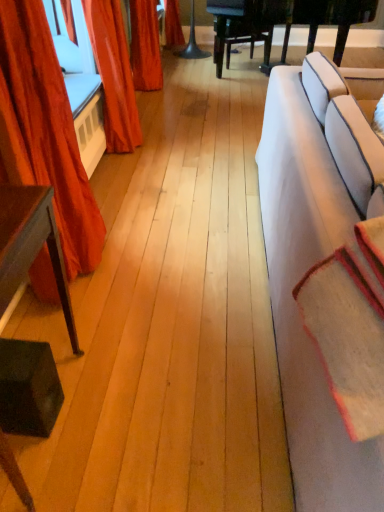
Question: Can you see velvet orange curtain at upper left, positioned as the second curtain in front-to-back order, touching velvet red curtain at left, acting as the 2th curtain starting from the back?

Choices:
 (A) yes
 (B) no

Answer: (B)

Question: Is velvet orange curtain at upper left, which appears as the first curtain when viewed from the back, at the right side of velvet red curtain at left, the 1th curtain viewed from the front?

Choices:
 (A) yes
 (B) no

Answer: (A)

Question: Is velvet orange curtain at upper left, which appears as the first curtain when viewed from the back, smaller than velvet red curtain at left, the 1th curtain viewed from the front?

Choices:
 (A) no
 (B) yes

Answer: (B)

Question: Is velvet orange curtain at upper left, which appears as the first curtain when viewed from the back, bigger than velvet red curtain at left, the 1th curtain viewed from the front?

Choices:
 (A) no
 (B) yes

Answer: (A)

Question: Considering the relative sizes of velvet orange curtain at upper left, which appears as the first curtain when viewed from the back, and velvet red curtain at left, acting as the 2th curtain starting from the back, in the image provided, is velvet orange curtain at upper left, which appears as the first curtain when viewed from the back, shorter than velvet red curtain at left, acting as the 2th curtain starting from the back,?

Choices:
 (A) no
 (B) yes

Answer: (B)

Question: From a real-world perspective, is dark brown wood table at left physically located above or below white fabric couch at right?

Choices:
 (A) above
 (B) below

Answer: (B)

Question: From the image's perspective, is dark brown wood table at left located above or below white fabric couch at right?

Choices:
 (A) below
 (B) above

Answer: (A)

Question: Considering the relative positions of dark brown wood table at left and white fabric couch at right in the image provided, is dark brown wood table at left to the left or to the right of white fabric couch at right?

Choices:
 (A) right
 (B) left

Answer: (B)

Question: Would you say dark brown wood table at left is inside or outside white fabric couch at right?

Choices:
 (A) inside
 (B) outside

Answer: (B)

Question: From their relative heights in the image, would you say white fabric couch at right is taller or shorter than beige woolen blanket at right?

Choices:
 (A) short
 (B) tall

Answer: (B)

Question: From a real-world perspective, is white fabric couch at right physically located above or below beige woolen blanket at right?

Choices:
 (A) above
 (B) below

Answer: (B)

Question: Does point (291, 87) appear closer or farther from the camera than point (345, 344)?

Choices:
 (A) farther
 (B) closer

Answer: (A)

Question: Considering their positions, is white fabric couch at right located in front of or behind beige woolen blanket at right?

Choices:
 (A) front
 (B) behind

Answer: (A)

Question: Is dark brown wood table at left bigger or smaller than beige woolen blanket at right?

Choices:
 (A) big
 (B) small

Answer: (A)

Question: From the image's perspective, is dark brown wood table at left above or below beige woolen blanket at right?

Choices:
 (A) above
 (B) below

Answer: (B)